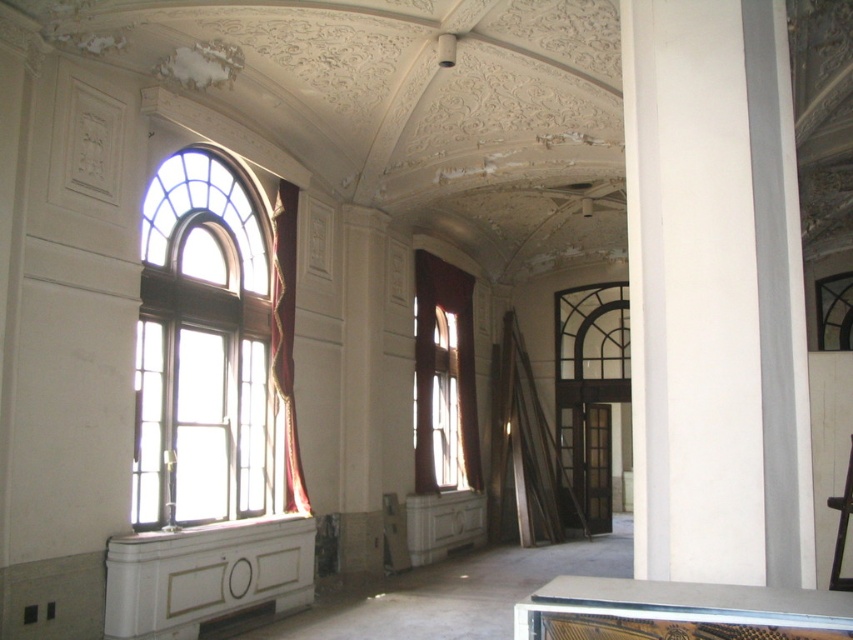
How much distance is there between clear glass window at left and velvet red curtain at left?

34.01 inches

Can you confirm if clear glass window at left is shorter than velvet red curtain at left?

Incorrect, clear glass window at left's height does not fall short of velvet red curtain at left's.

The image size is (853, 640). In order to click on clear glass window at left in this screenshot , I will do `click(204, 346)`.

Where is `clear glass window at left`? clear glass window at left is located at coordinates [204, 346].

Which is more to the left, white smooth pillar at center or matte red curtain at center?

Positioned to the left is matte red curtain at center.

Does point (679, 234) come farther from viewer compared to point (463, 301)?

No, it is in front of (463, 301).

The width and height of the screenshot is (853, 640). I want to click on white smooth pillar at center, so point(697,284).

Can you confirm if white smooth pillar at center is positioned below velvet red curtain at left?

Incorrect, white smooth pillar at center is not positioned below velvet red curtain at left.

Who is lower down, white smooth pillar at center or velvet red curtain at left?

Positioned lower is velvet red curtain at left.

The width and height of the screenshot is (853, 640). Find the location of `white smooth pillar at center`. white smooth pillar at center is located at coordinates (697, 284).